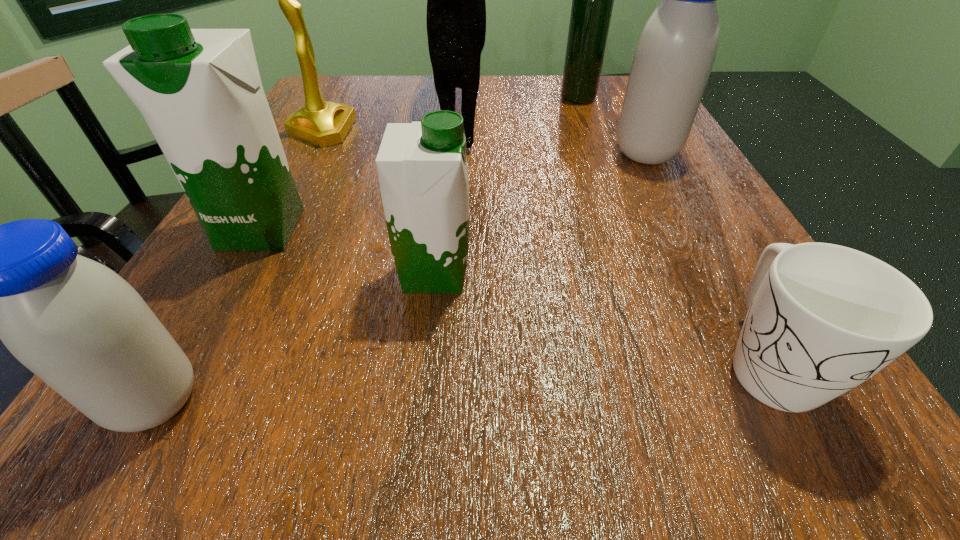
Identify the location of free space between the black cat and the liquor. (519, 107).

This screenshot has height=540, width=960. I want to click on unoccupied position between the mug and the bigger green soya milk, so (x=514, y=294).

Where is `free space between the mug and the nearer blue soya milk`? free space between the mug and the nearer blue soya milk is located at coordinates (462, 381).

The image size is (960, 540). What are the coordinates of `free area in between the green liquor and the second soya milk from right to left` in the screenshot? It's located at (506, 186).

Identify which object is the sixth nearest to the bigger blue soya milk. Please provide its 2D coordinates. Your answer should be formatted as a tuple, i.e. [(x, y)], where the tuple contains the x and y coordinates of a point satisfying the conditions above.

[(199, 90)]

Locate which object is the closest to the bigger green soya milk. Please provide its 2D coordinates. Your answer should be formatted as a tuple, i.e. [(x, y)], where the tuple contains the x and y coordinates of a point satisfying the conditions above.

[(422, 169)]

You are a GUI agent. You are given a task and a screenshot of the screen. Output one action in this format:
    pyautogui.click(x=<x>, y=<y>)
    Task: Click on the soya milk that stands as the closest to the farther blue soya milk
    The width and height of the screenshot is (960, 540).
    Given the screenshot: What is the action you would take?
    (422, 169)

Where is `soya milk identified as the closest to the golden award`? This screenshot has width=960, height=540. soya milk identified as the closest to the golden award is located at coordinates (199, 90).

What are the coordinates of `free space that satisfies the following two spatial constraints: 1. on the face of the black cat; 2. on the right side of the bigger blue soya milk` in the screenshot? It's located at (459, 154).

At what (x,y) coordinates should I click in order to perform the action: click on vacant space that satisfies the following two spatial constraints: 1. on the face of the black cat; 2. on the left side of the farthest soya milk. Please return your answer as a coordinate pair (x, y). Looking at the image, I should click on (459, 154).